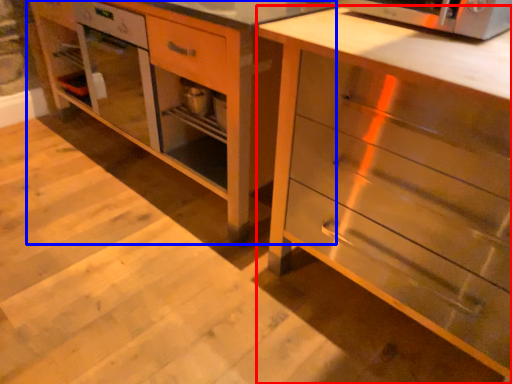
Question: Which of the following is the closest to the observer, chest of drawers (highlighted by a red box) or vanity (highlighted by a blue box)?

Choices:
 (A) chest of drawers
 (B) vanity

Answer: (A)